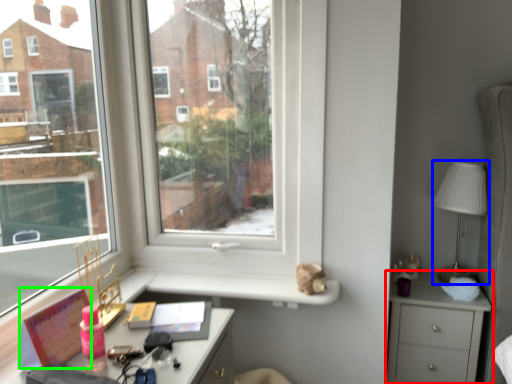
Question: Which object is the farthest from chest of drawers (highlighted by a red box)? Choose among these: table lamp (highlighted by a blue box) or book (highlighted by a green box).

Choices:
 (A) table lamp
 (B) book

Answer: (B)